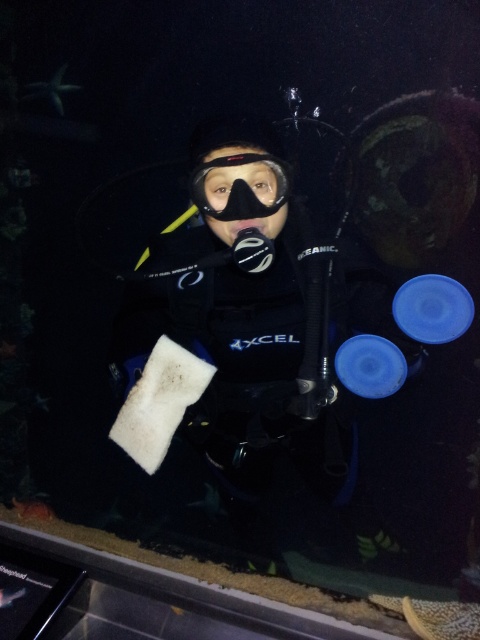
Question: Is black matte wetsuit at center positioned in front of black matte snorkel mask at center?

Choices:
 (A) no
 (B) yes

Answer: (A)

Question: Which point appears closest to the camera in this image?

Choices:
 (A) (142, 426)
 (B) (212, 208)

Answer: (B)

Question: Among these points, which one is nearest to the camera?

Choices:
 (A) (262, 243)
 (B) (282, 170)

Answer: (A)

Question: Does black matte wetsuit at center appear under black matte snorkel mask at center?

Choices:
 (A) no
 (B) yes

Answer: (B)

Question: Which point appears closest to the camera in this image?

Choices:
 (A) (261, 157)
 (B) (242, 356)

Answer: (A)

Question: Is black matte wetsuit at center positioned in front of black matte snorkel mask at center?

Choices:
 (A) no
 (B) yes

Answer: (A)